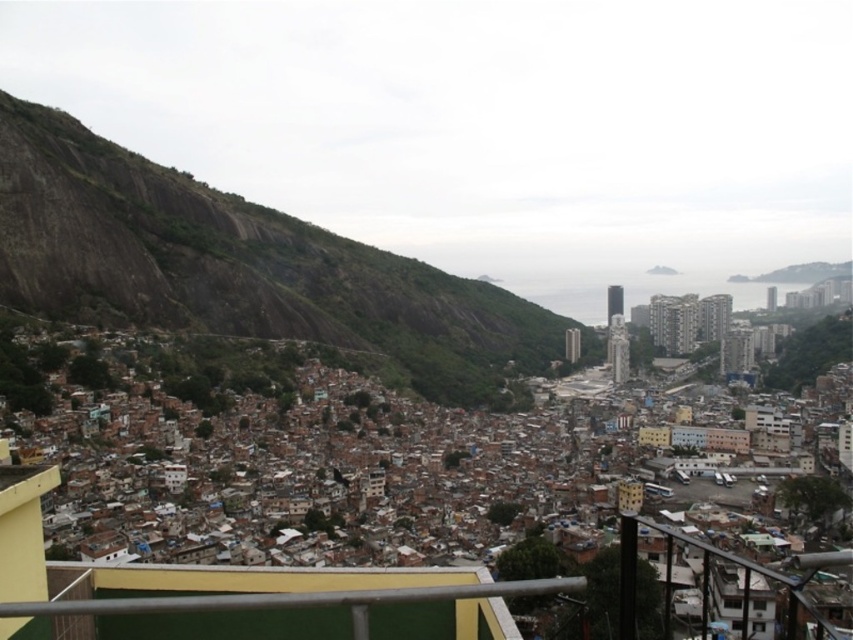
Question: Which point is closer to the camera?

Choices:
 (A) (401, 337)
 (B) (355, 637)

Answer: (B)

Question: Which of the following is the farthest from the observer?

Choices:
 (A) metallic gray railing at lower center
 (B) rustic stone mountain at left

Answer: (B)

Question: Can you confirm if rustic stone mountain at left is bigger than metallic gray railing at lower center?

Choices:
 (A) yes
 (B) no

Answer: (A)

Question: Can you confirm if rustic stone mountain at left is positioned to the right of metallic gray railing at lower center?

Choices:
 (A) yes
 (B) no

Answer: (B)

Question: Which point is closer to the camera taking this photo?

Choices:
 (A) (80, 202)
 (B) (70, 609)

Answer: (B)

Question: Is rustic stone mountain at left behind metallic gray railing at lower center?

Choices:
 (A) no
 (B) yes

Answer: (B)